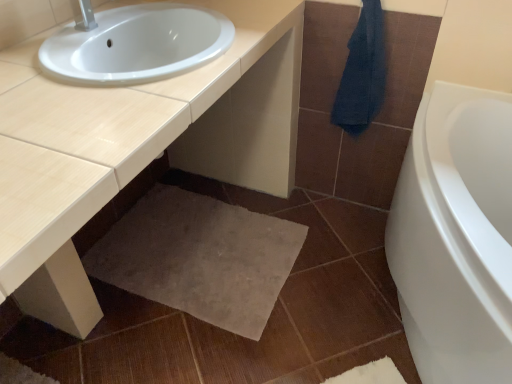
Question: Is point (362, 72) closer or farther from the camera than point (108, 213)?

Choices:
 (A) closer
 (B) farther

Answer: (A)

Question: From the image's perspective, is dark blue towel at upper right positioned above or below beige glossy countertop at center?

Choices:
 (A) above
 (B) below

Answer: (A)

Question: Which of these objects is positioned closest to the dark blue towel at upper right?

Choices:
 (A) beige glossy countertop at center
 (B) beige carpet at lower center

Answer: (A)

Question: Which of these objects is positioned farthest from the dark blue towel at upper right?

Choices:
 (A) beige glossy countertop at center
 (B) beige carpet at lower center

Answer: (B)